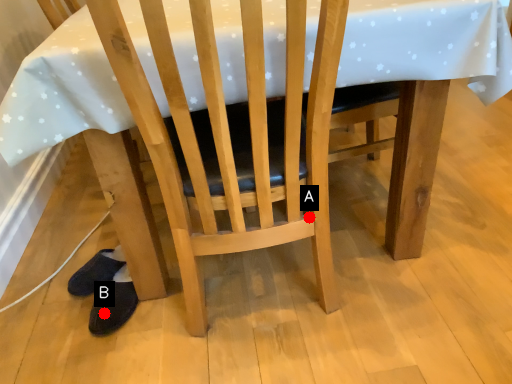
Question: Two points are circled on the image, labeled by A and B beside each circle. Which point is farther to the camera?

Choices:
 (A) A is further
 (B) B is further

Answer: (B)